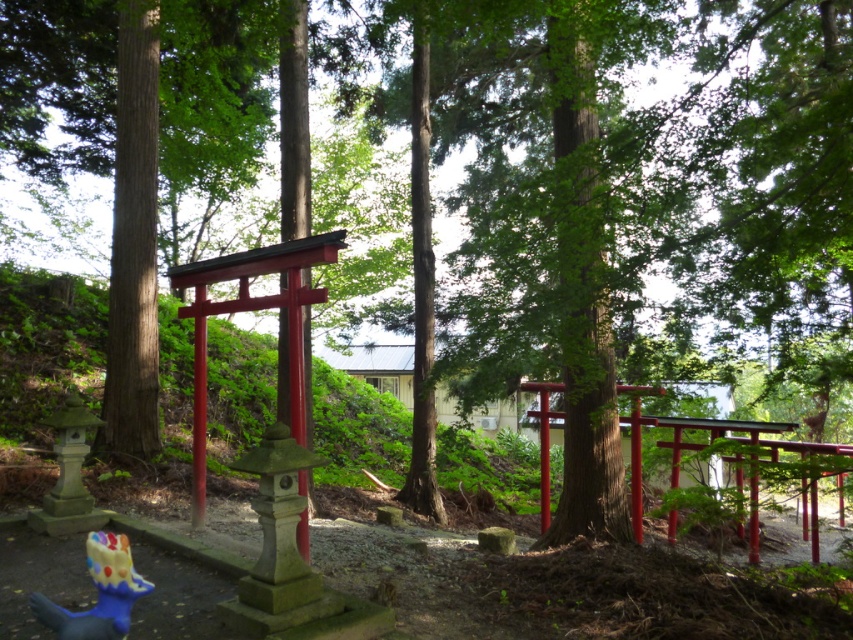
You are a visitor at a Japanese garden and see the metallic red torii gate at center and the blue rubber toy at lower left. Which object is taller?

The blue rubber toy at lower left is taller than the metallic red torii gate at center.

You are standing at the entrance of the forest path and see the metallic red torii gate at center. If you walk straight ahead, will you eventually see another torii gate behind it?

Yes, there is another torii gate further back in the scene, so walking straight ahead would lead you to see additional torii gates in the distance.